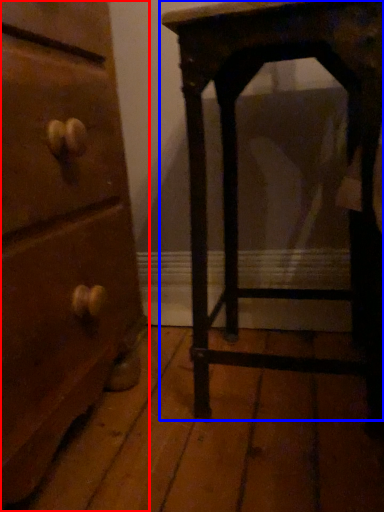
Question: Among these objects, which one is farthest to the camera, chest of drawers (highlighted by a red box) or furniture (highlighted by a blue box)?

Choices:
 (A) chest of drawers
 (B) furniture

Answer: (B)